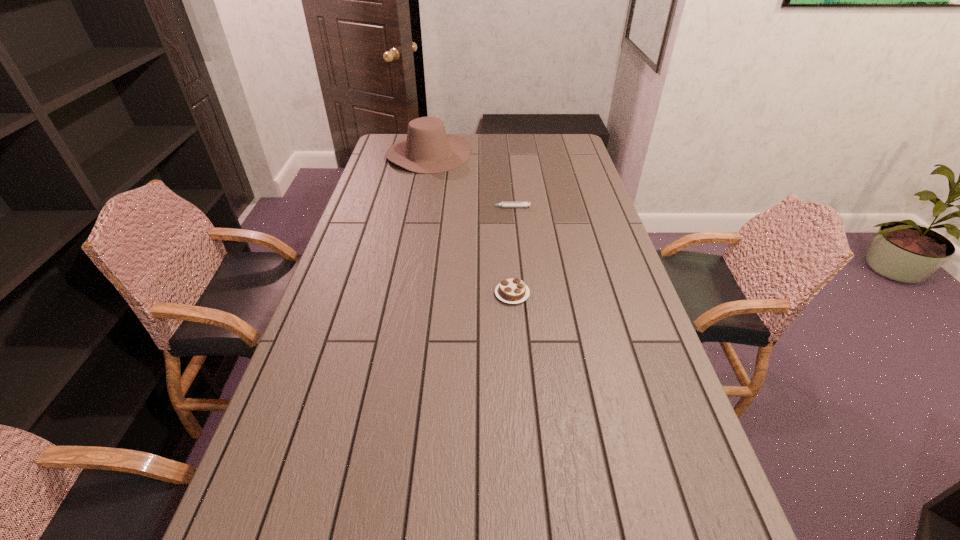
Find the location of a particular element. the leftmost object is located at coordinates (428, 149).

Image resolution: width=960 pixels, height=540 pixels. I want to click on the farthest object, so click(x=428, y=149).

Identify the location of chocolate cake. (514, 290).

Find the location of a particular element. The width and height of the screenshot is (960, 540). the nearest object is located at coordinates (514, 290).

This screenshot has height=540, width=960. Find the location of `syringe`. syringe is located at coordinates (503, 204).

Locate an element on the screen. The image size is (960, 540). the second farthest object is located at coordinates (503, 204).

Where is `free space located 0.400m on the right of the farthest object`? The image size is (960, 540). free space located 0.400m on the right of the farthest object is located at coordinates 559,153.

This screenshot has height=540, width=960. I want to click on free point located 0.240m on the back of the chocolate cake, so click(508, 236).

Locate an element on the screen. Image resolution: width=960 pixels, height=540 pixels. vacant space located 0.310m at the needle end of the second nearest object is located at coordinates (404, 207).

The image size is (960, 540). What are the coordinates of `vacant area situated 0.130m at the needle end of the second nearest object` in the screenshot? It's located at [x=452, y=207].